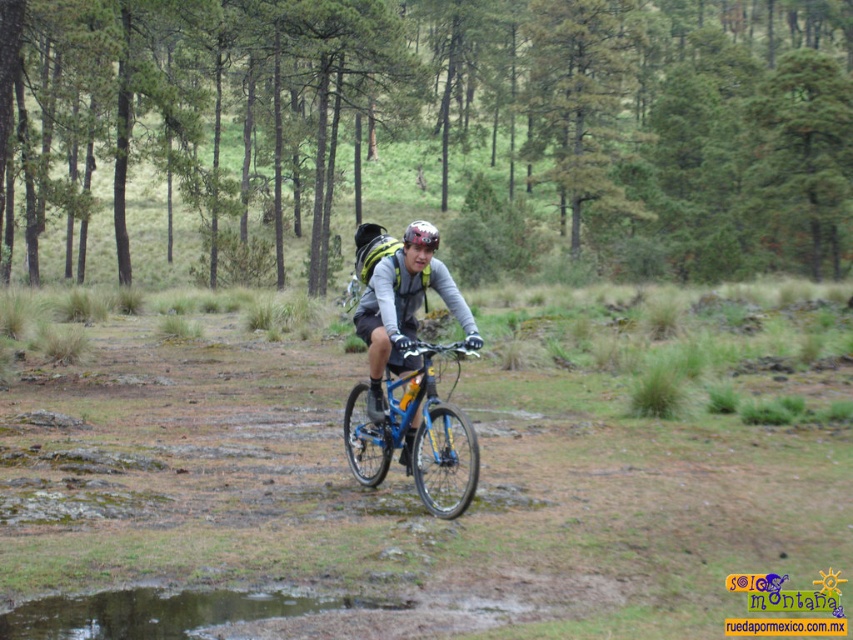
Is green matte forest at upper center below shiny dark water at lower left?

Actually, green matte forest at upper center is above shiny dark water at lower left.

At what (x,y) coordinates should I click in order to perform the action: click on green matte forest at upper center. Please return your answer as a coordinate pair (x, y). This screenshot has width=853, height=640. Looking at the image, I should click on (445, 124).

Between shiny dark water at lower left and shiny silver helmet at center, which one has more height?

shiny silver helmet at center is taller.

In the scene shown: Who is positioned more to the left, shiny dark water at lower left or shiny silver helmet at center?

Positioned to the left is shiny dark water at lower left.

At what (x,y) coordinates should I click in order to perform the action: click on shiny dark water at lower left. Please return your answer as a coordinate pair (x, y). Looking at the image, I should click on (161, 611).

The height and width of the screenshot is (640, 853). In order to click on shiny dark water at lower left in this screenshot , I will do `click(161, 611)`.

The height and width of the screenshot is (640, 853). Describe the element at coordinates (416, 440) in the screenshot. I see `blue metallic bicycle at center` at that location.

Between blue metallic bicycle at center and shiny silver helmet at center, which one has less height?

Standing shorter between the two is blue metallic bicycle at center.

Locate an element on the screen. The height and width of the screenshot is (640, 853). blue metallic bicycle at center is located at coordinates (416, 440).